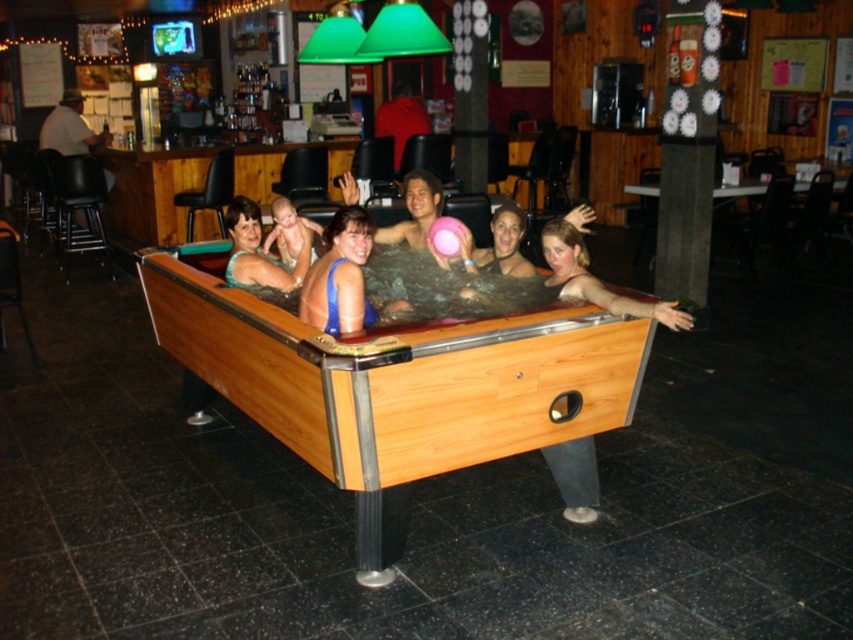
Does wooden pool table at center have a lesser height compared to matte blue swimsuit at center?

Incorrect, wooden pool table at center's height does not fall short of matte blue swimsuit at center's.

Does point (426, 472) come behind point (228, 273)?

No, (426, 472) is in front of (228, 273).

You are a GUI agent. You are given a task and a screenshot of the screen. Output one action in this format:
    pyautogui.click(x=<x>, y=<y>)
    Task: Click on the wooden pool table at center
    This screenshot has height=640, width=853.
    Given the screenshot: What is the action you would take?
    click(x=402, y=388)

Find the location of a particular element. wooden pool table at center is located at coordinates (402, 388).